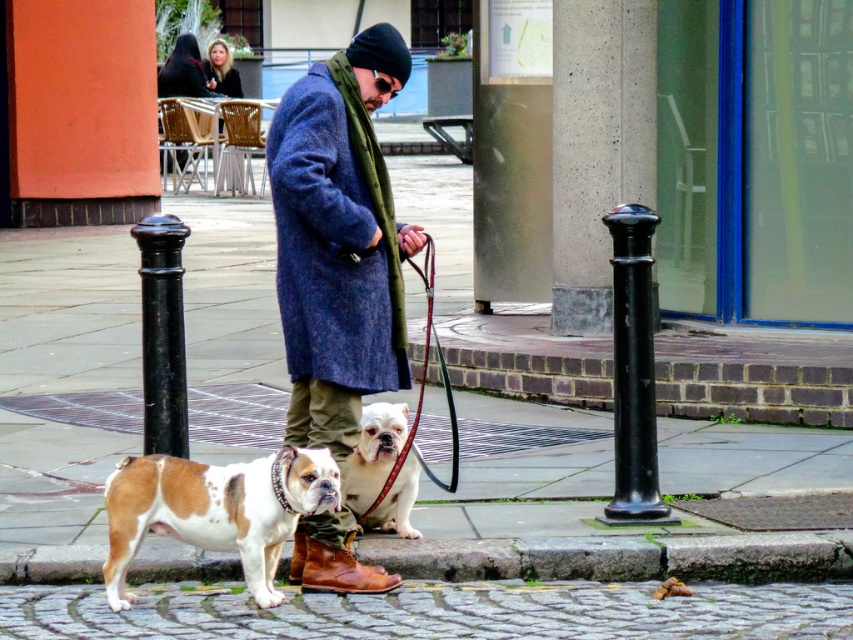
You are a delivery drone flying over a street scene. You need to land precisely on the black polished metal pole at center. According to the coordinates provided, where should you aim to land?

The black polished metal pole at center is located at coordinates point (161, 333), so you should aim for that exact point to land precisely on it.

You are a delivery robot with a width of 24 inches. You need to navigate between the black polished metal pole at center and the white fur dog at lower center on the sidewalk. Can you fit through the space between them?

The distance between the black polished metal pole at center and the white fur dog at lower center is 35.39 inches. Since the robot is 24 inches wide, it can fit through the space as the distance is wider than the robot.

You are a delivery drone flying above the street scene. You need to drop a package at the exact location of the blue wool coat at center. The coordinates for the drop zone are given as point (339,241). Can you confirm if the package will land precisely on the blue wool coat at center?

Yes, the package will land precisely on the blue wool coat at center because the coordinates point (339,241) directly correspond to its location.